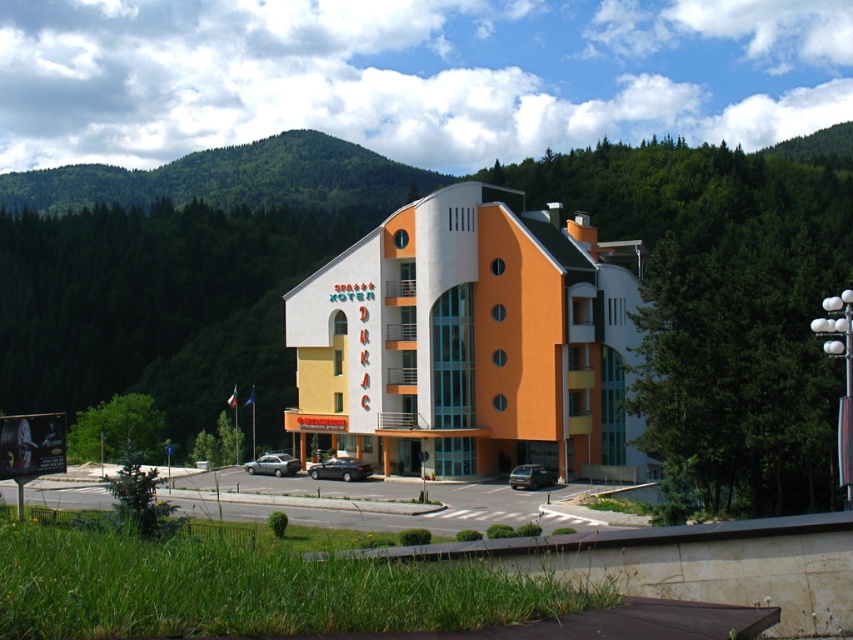
You are standing in front of the Dukac building and see two points marked on the facade. The first point is at coordinates point (352,458) and the second is at point (541,468). Which point is closer to you?

Point (352,458) is further to the viewer than point (541,468), so the second point is closer to you.

You are a visitor arriving at Dukac. You see a satin black sedan at center and a dark gray matte van at lower center. Which vehicle is positioned higher in the image?

The satin black sedan at center is positioned higher than the dark gray matte van at lower center in the image.